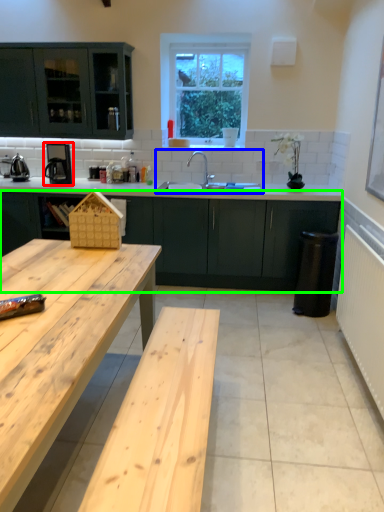
Question: Estimate the real-world distances between objects in this image. Which object is closer to coffee machine (highlighted by a red box), sink (highlighted by a blue box) or cabinetry (highlighted by a green box)?

Choices:
 (A) sink
 (B) cabinetry

Answer: (A)